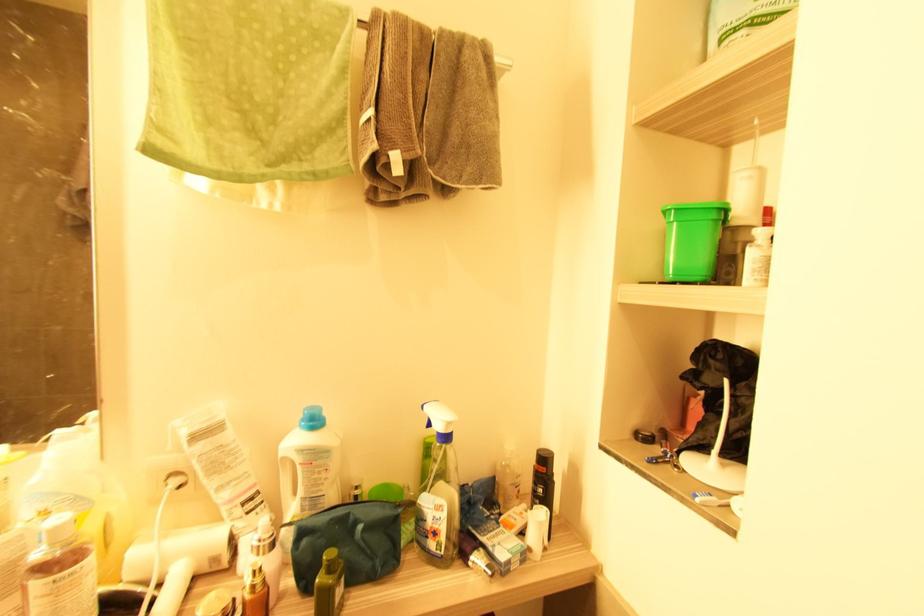
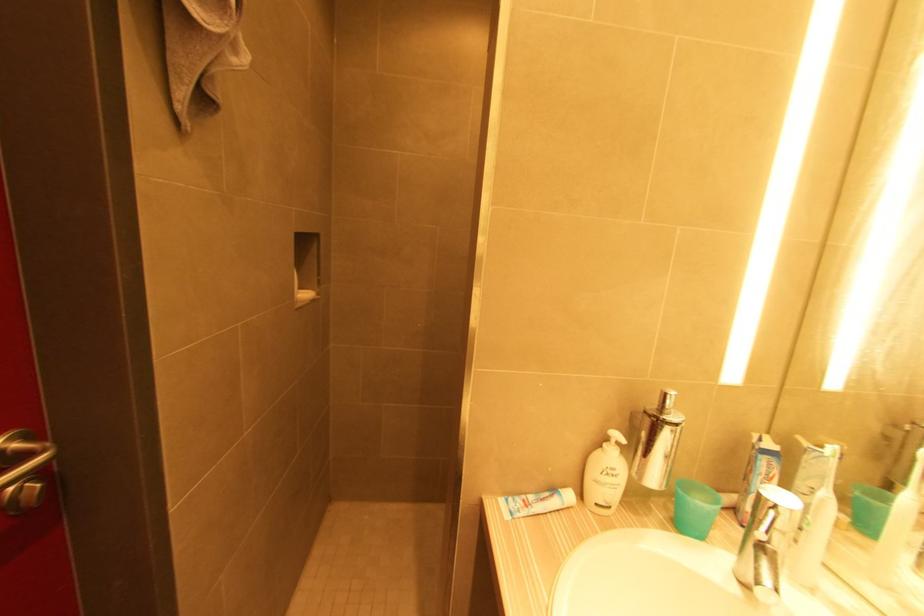
Question: How did the camera likely rotate?

Choices:
 (A) Left
 (B) Right
 (C) Up
 (D) Down

Answer: (A)